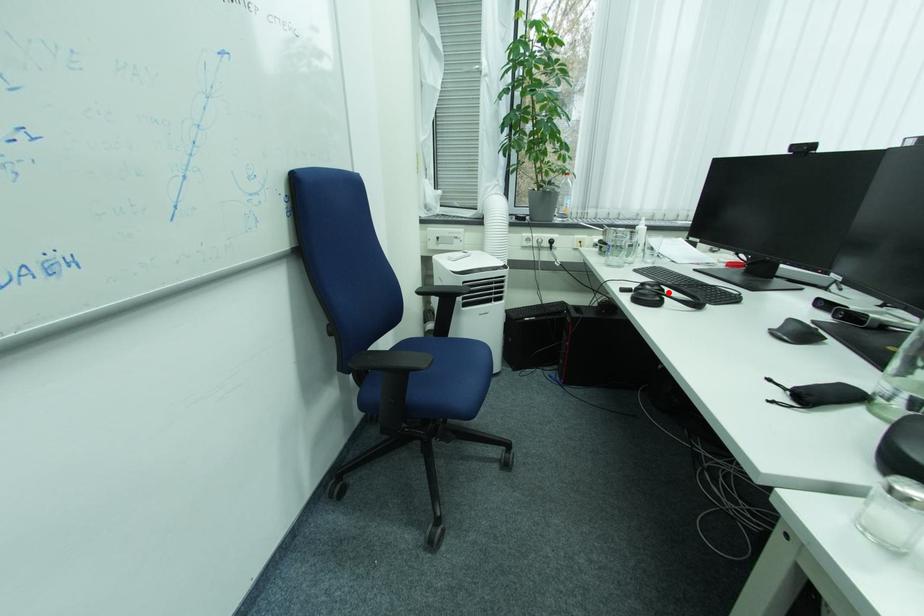
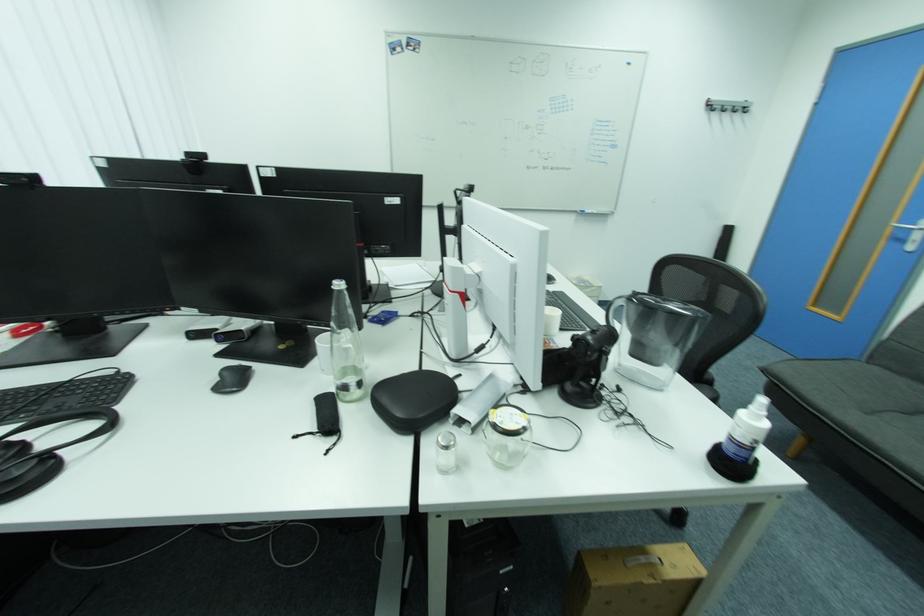
In the second image, find the point that corresponds to the highlighted location in the first image.

(29, 447)